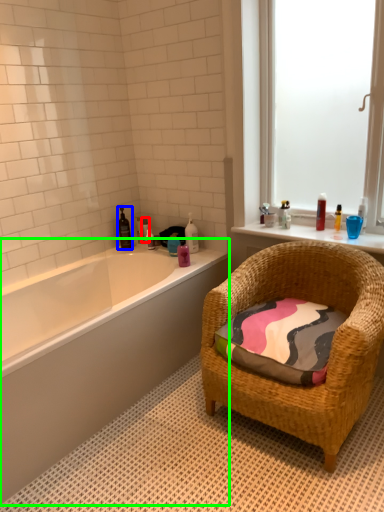
Question: Which object is the closest to the toiletry (highlighted by a red box)? Choose among these: toiletry (highlighted by a blue box) or bathtub (highlighted by a green box).

Choices:
 (A) toiletry
 (B) bathtub

Answer: (A)